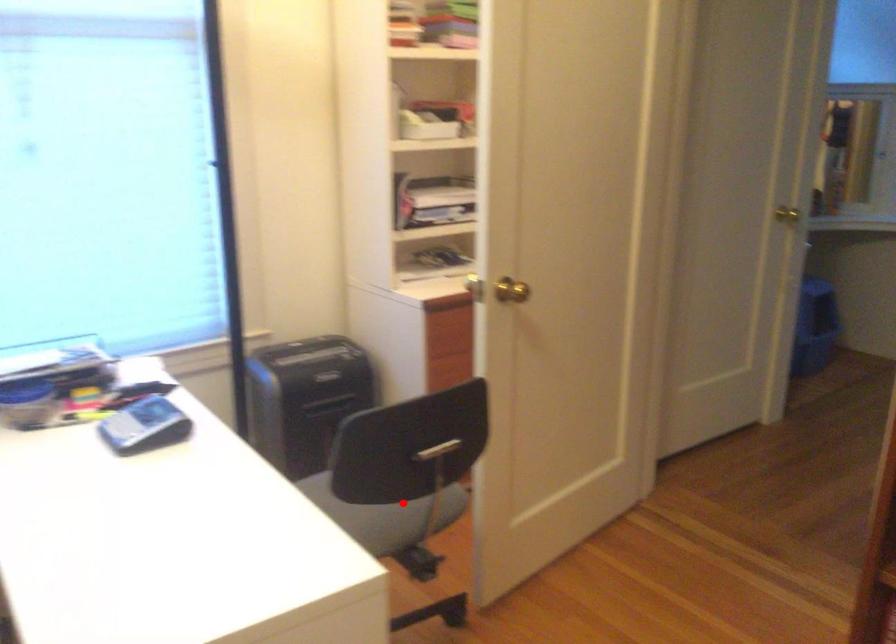
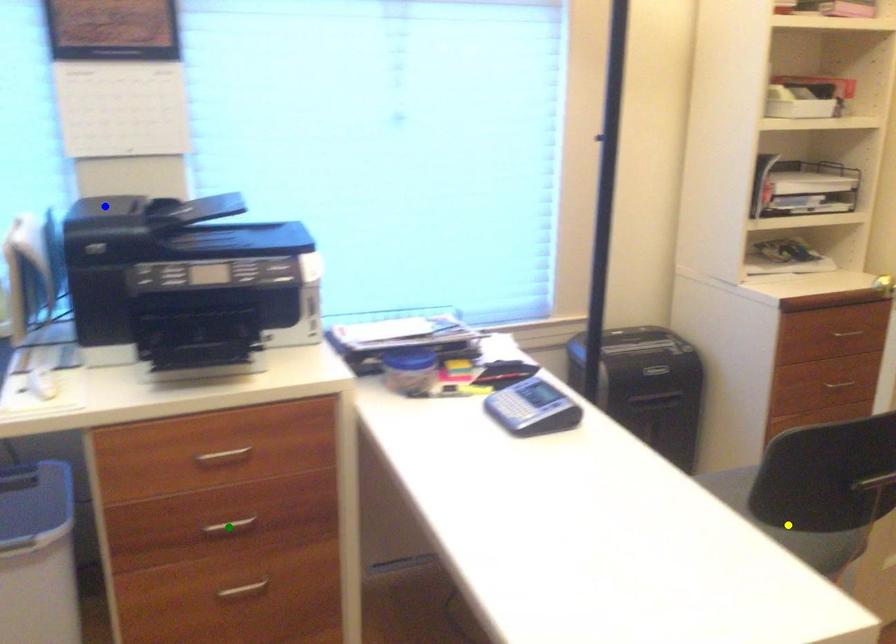
Question: I am providing you with two images of the same scene from different viewpoints. A red point is marked on the first image. You are given multiple points on the second image. Which point in image 2 is actually the same real-world point as the red point in image 1?

Choices:
 (A) green point
 (B) yellow point
 (C) blue point

Answer: (B)